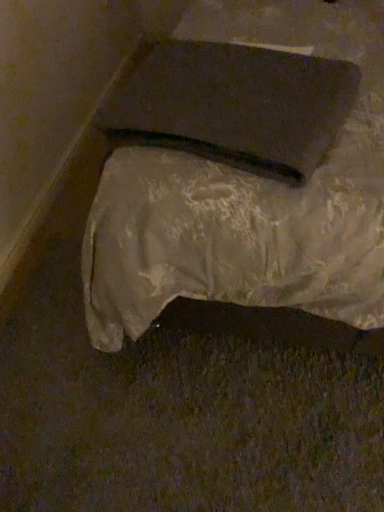
Question: Choose the correct answer: Is matte black pad at upper center inside white fabric-covered object at center or outside it?

Choices:
 (A) inside
 (B) outside

Answer: (A)

Question: Considering the relative positions of matte black pad at upper center and white fabric-covered object at center in the image provided, is matte black pad at upper center to the left or to the right of white fabric-covered object at center?

Choices:
 (A) right
 (B) left

Answer: (B)

Question: From the image's perspective, is matte black pad at upper center positioned above or below white fabric-covered object at center?

Choices:
 (A) below
 (B) above

Answer: (A)

Question: Does point (132, 103) appear closer or farther from the camera than point (122, 93)?

Choices:
 (A) farther
 (B) closer

Answer: (B)

Question: Is white fabric-covered object at center spatially inside matte black pad at upper center, or outside of it?

Choices:
 (A) outside
 (B) inside

Answer: (A)

Question: In the image, is white fabric-covered object at center positioned in front of or behind matte black pad at upper center?

Choices:
 (A) front
 (B) behind

Answer: (A)

Question: Is white fabric-covered object at center taller or shorter than matte black pad at upper center?

Choices:
 (A) short
 (B) tall

Answer: (B)